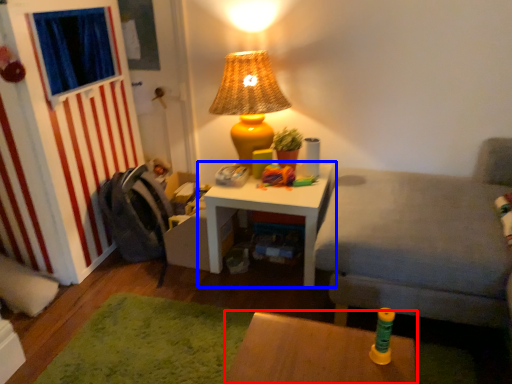
Question: Which object is further to the camera taking this photo, table (highlighted by a red box) or table (highlighted by a blue box)?

Choices:
 (A) table
 (B) table

Answer: (B)